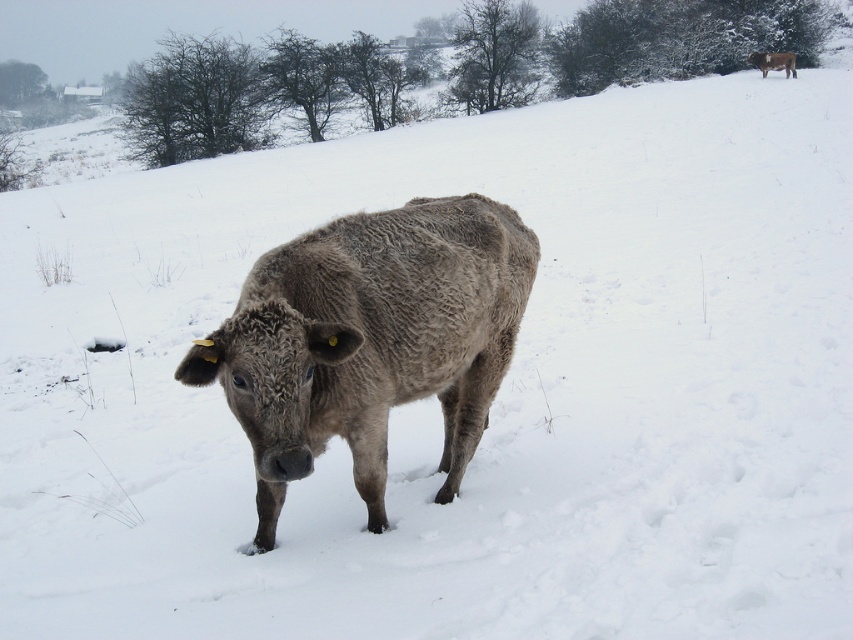
Question: Does gray woolly bison at center lie in front of gray woolly cow at upper right?

Choices:
 (A) yes
 (B) no

Answer: (A)

Question: Considering the relative positions of gray woolly bison at center and gray woolly cow at upper right in the image provided, where is gray woolly bison at center located with respect to gray woolly cow at upper right?

Choices:
 (A) below
 (B) above

Answer: (A)

Question: Which of the following is the farthest from the observer?

Choices:
 (A) gray woolly bison at center
 (B) gray woolly cow at upper right

Answer: (B)

Question: Does gray woolly bison at center appear on the left side of gray woolly cow at upper right?

Choices:
 (A) yes
 (B) no

Answer: (A)